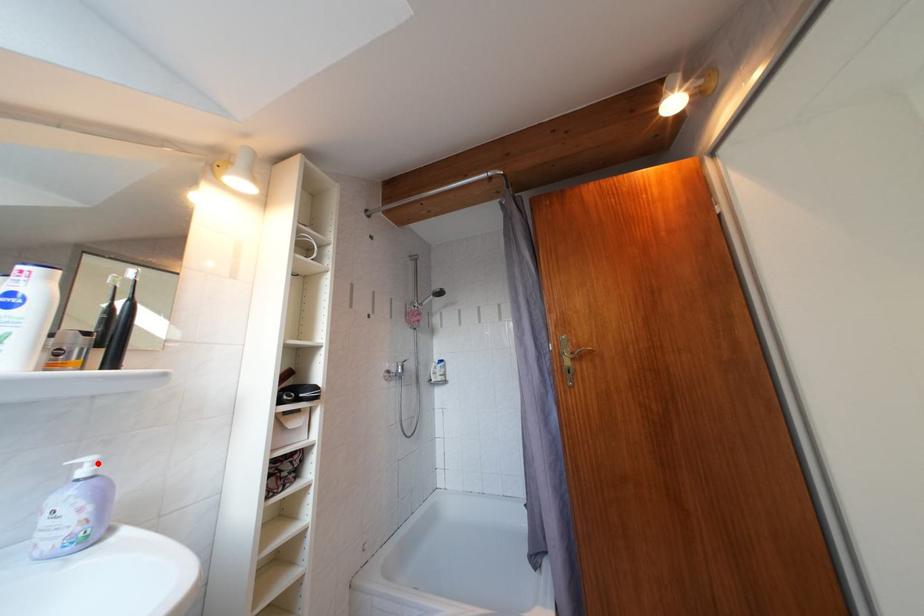
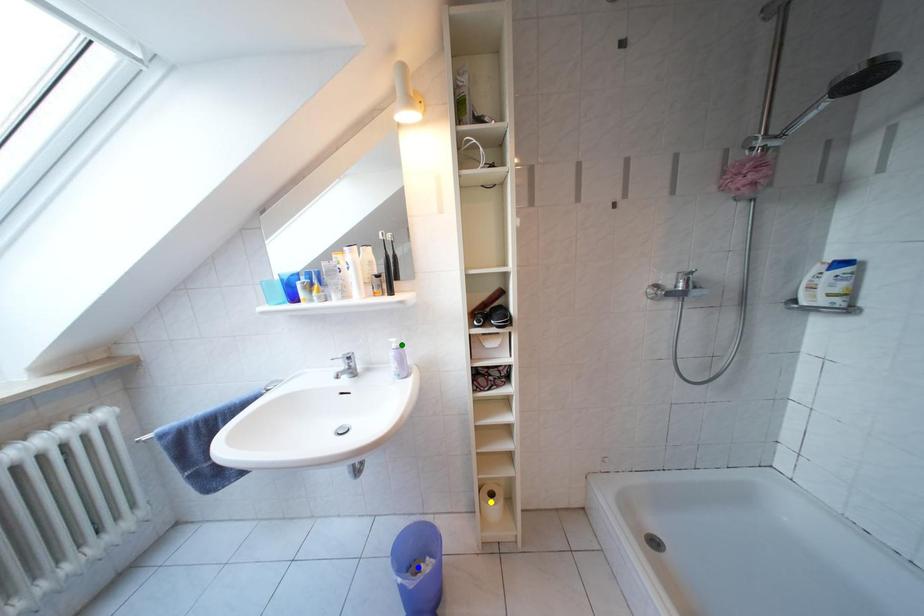
Question: I am providing you with two images of the same scene from different viewpoints. A red point is marked on the first image. You are given multiple points on the second image. Can you choose the point in image 2 that corresponds to the point in image 1?

Choices:
 (A) blue point
 (B) green point
 (C) yellow point

Answer: (B)